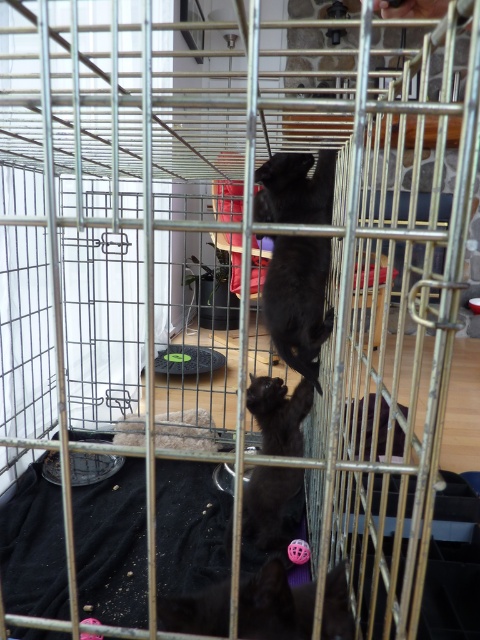
Question: Which point appears farthest from the camera in this image?

Choices:
 (A) (269, 289)
 (B) (241, 525)

Answer: (A)

Question: Among these objects, which one is nearest to the camera?

Choices:
 (A) black matte fur cat at center
 (B) black matte cat at center

Answer: (A)

Question: In this image, where is black matte fur cat at center located relative to black matte cat at center?

Choices:
 (A) right
 (B) left

Answer: (A)

Question: Is black matte fur cat at center below black matte cat at center?

Choices:
 (A) no
 (B) yes

Answer: (A)

Question: Which object appears closest to the camera in this image?

Choices:
 (A) black matte fur cat at center
 (B) black matte cat at center

Answer: (A)

Question: From the image, what is the correct spatial relationship of black matte fur cat at center in relation to black matte cat at center?

Choices:
 (A) left
 (B) right

Answer: (B)